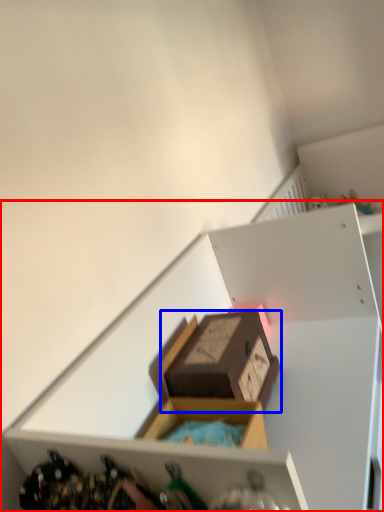
Question: Which object appears farthest to the camera in this image, shelf (highlighted by a red box) or box (highlighted by a blue box)?

Choices:
 (A) shelf
 (B) box

Answer: (B)